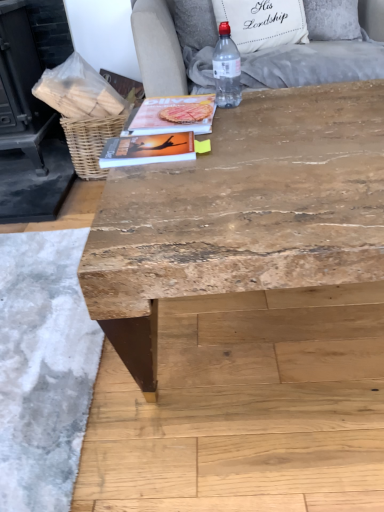
Question: Considering the relative sizes of light gray fabric armchair at upper center and white fabric pillow at upper center in the image provided, is light gray fabric armchair at upper center shorter than white fabric pillow at upper center?

Choices:
 (A) yes
 (B) no

Answer: (B)

Question: Is light gray fabric armchair at upper center outside white fabric pillow at upper center?

Choices:
 (A) no
 (B) yes

Answer: (B)

Question: Does light gray fabric armchair at upper center appear on the right side of white fabric pillow at upper center?

Choices:
 (A) yes
 (B) no

Answer: (A)

Question: Is light gray fabric armchair at upper center thinner than white fabric pillow at upper center?

Choices:
 (A) no
 (B) yes

Answer: (A)

Question: Is light gray fabric armchair at upper center positioned far away from white fabric pillow at upper center?

Choices:
 (A) yes
 (B) no

Answer: (B)

Question: From the image's perspective, is natural wood table at center located above or below clear plastic bottle at upper center?

Choices:
 (A) above
 (B) below

Answer: (B)

Question: In terms of height, does natural wood table at center look taller or shorter compared to clear plastic bottle at upper center?

Choices:
 (A) short
 (B) tall

Answer: (B)

Question: Choose the correct answer: Is natural wood table at center inside clear plastic bottle at upper center or outside it?

Choices:
 (A) inside
 (B) outside

Answer: (B)

Question: In the image, is natural wood table at center on the left side or the right side of clear plastic bottle at upper center?

Choices:
 (A) right
 (B) left

Answer: (A)

Question: Is woven brown basket at upper left spatially inside natural wood table at center, or outside of it?

Choices:
 (A) outside
 (B) inside

Answer: (A)

Question: Considering the positions of woven brown basket at upper left and natural wood table at center in the image, is woven brown basket at upper left taller or shorter than natural wood table at center?

Choices:
 (A) tall
 (B) short

Answer: (B)

Question: Relative to natural wood table at center, is woven brown basket at upper left in front or behind?

Choices:
 (A) front
 (B) behind

Answer: (B)

Question: From a real-world perspective, is woven brown basket at upper left physically located above or below natural wood table at center?

Choices:
 (A) below
 (B) above

Answer: (A)

Question: Considering their positions, is matte paper magazine at center, the second magazine from the front, located in front of or behind white fabric pillow at upper center?

Choices:
 (A) behind
 (B) front

Answer: (B)

Question: Would you say matte paper magazine at center, positioned as the first magazine in back-to-front order, is inside or outside white fabric pillow at upper center?

Choices:
 (A) inside
 (B) outside

Answer: (B)